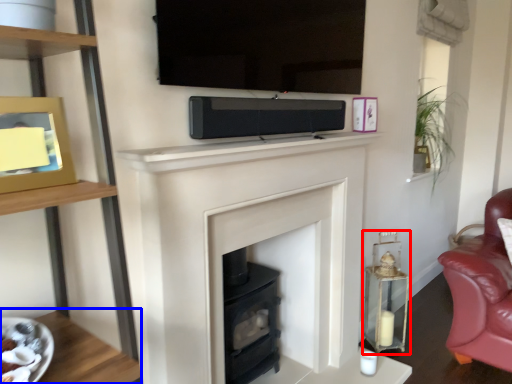
Question: Which of the following is the closest to the observer, candle holder (highlighted by a red box) or table (highlighted by a blue box)?

Choices:
 (A) candle holder
 (B) table

Answer: (B)